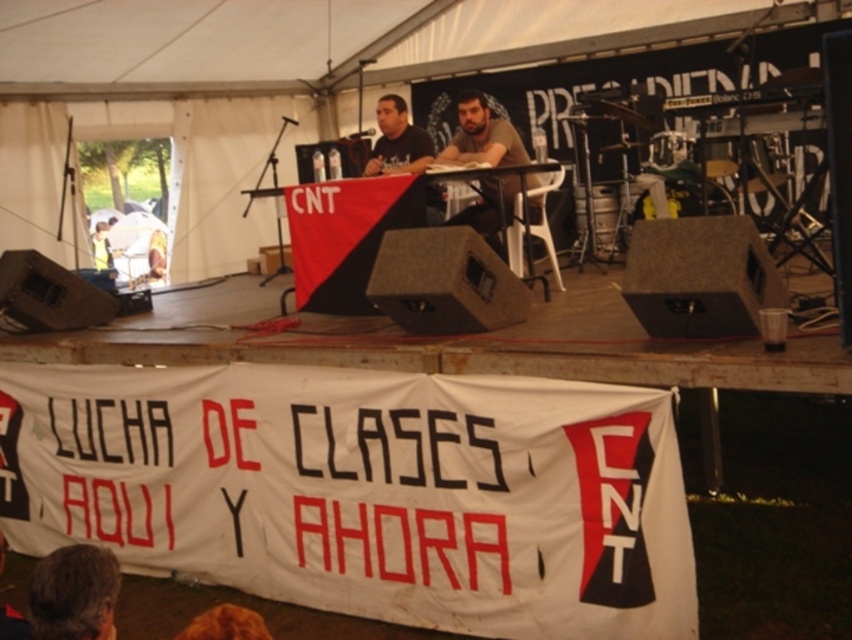
Question: Considering the relative positions of brown fur at lower center and dark brown leather jacket at lower left in the image provided, where is brown fur at lower center located with respect to dark brown leather jacket at lower left?

Choices:
 (A) below
 (B) above

Answer: (B)

Question: Among these points, which one is nearest to the camera?

Choices:
 (A) (58, 634)
 (B) (412, 132)
 (C) (438, 161)
 (D) (214, 628)

Answer: (D)

Question: Which object appears closest to the camera in this image?

Choices:
 (A) brown fur at lower center
 (B) dark brown leather jacket at lower left

Answer: (A)

Question: Is brown hair at lower left thinner than black t-shirt at center?

Choices:
 (A) no
 (B) yes

Answer: (B)

Question: Can you confirm if brown matte shirt at center is wider than black t-shirt at center?

Choices:
 (A) yes
 (B) no

Answer: (A)

Question: Estimate the real-world distances between objects in this image. Which object is farther from the brown matte shirt at center?

Choices:
 (A) brown fur at lower center
 (B) brown hair at lower left
 (C) dark brown leather jacket at lower left

Answer: (A)